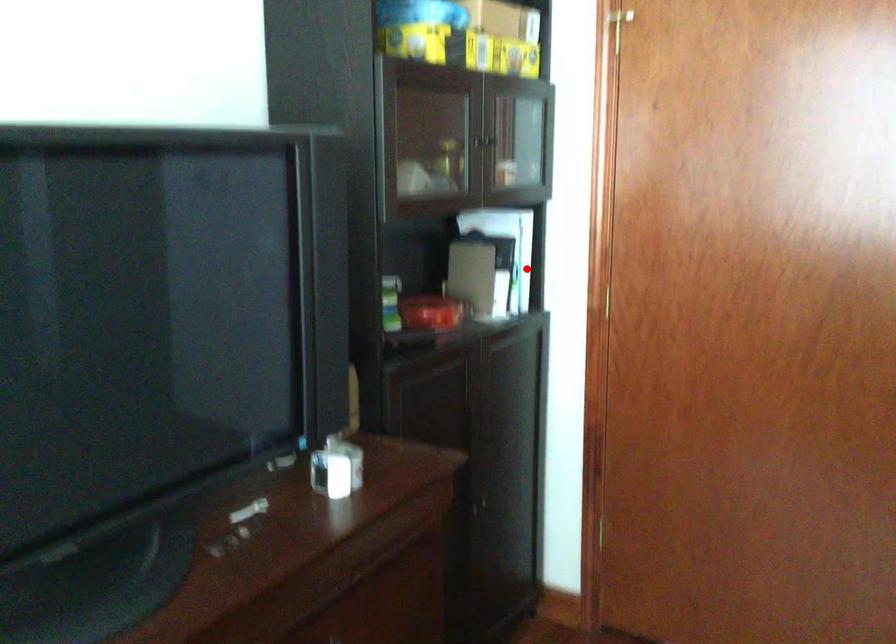
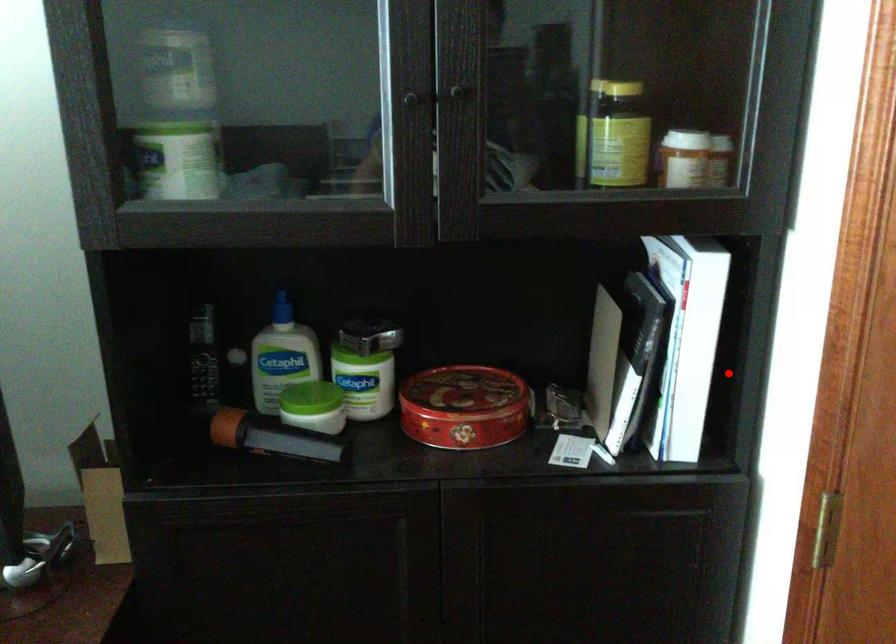
I am providing you with two images of the same scene from different viewpoints. A red point is marked on the first image and another point is marked on the second image. Is the marked point in image1 the same physical position as the marked point in image2?

Yes